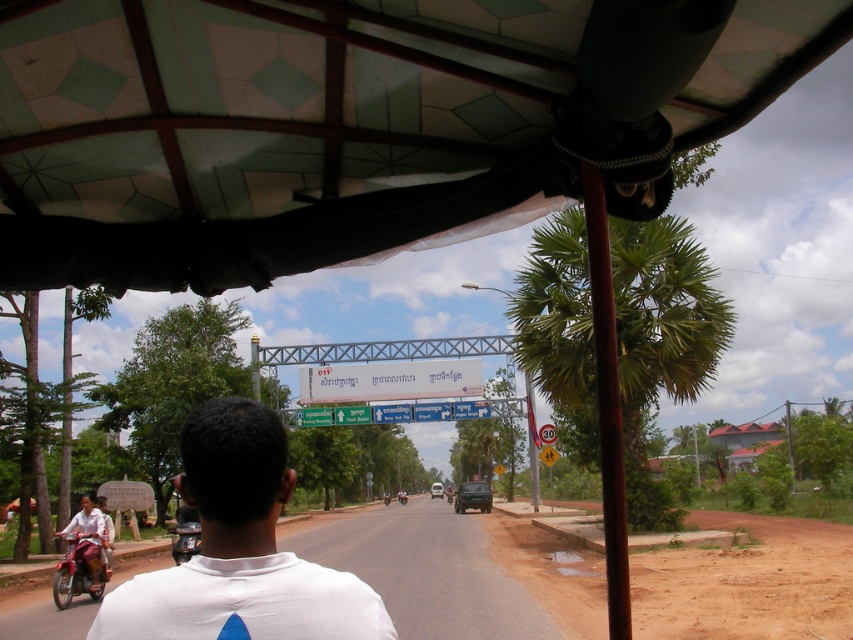
Question: Is white plastic sign at center thinner than metallic red motorcycle at lower left?

Choices:
 (A) no
 (B) yes

Answer: (A)

Question: Which object is the closest to the brown dirt track at lower right?

Choices:
 (A) metallic silver scooter at lower left
 (B) green leafy palm tree at right
 (C) metallic red motorcycle at lower left

Answer: (B)

Question: Considering the real-world distances, which object is closest to the transparent plastic canopy at upper center?

Choices:
 (A) green leafy palm tree at right
 (B) white matte shirt at center

Answer: (B)

Question: Is white plastic sign at center above metallic silver scooter at lower left?

Choices:
 (A) yes
 (B) no

Answer: (A)

Question: Observing the image, what is the correct spatial positioning of green leafy palm tree at right in reference to metallic silver scooter at lower left?

Choices:
 (A) left
 (B) right

Answer: (B)

Question: Estimate the real-world distances between objects in this image. Which object is closer to the metallic silver scooter at lower left?

Choices:
 (A) metallic red motorcycle at lower left
 (B) white matte shirt at center

Answer: (A)